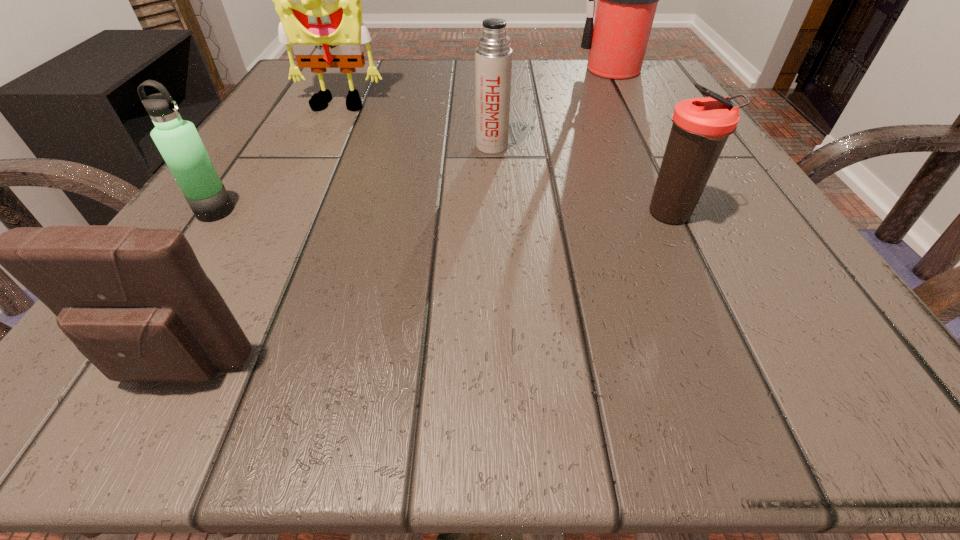
At what (x,y) coordinates should I click in order to perform the action: click on free space between the pouch and the fourth nearest object. Please return your answer as a coordinate pair (x, y). Looking at the image, I should click on (335, 258).

Locate which object ranks fifth in proximity to the pouch. Please provide its 2D coordinates. Your answer should be formatted as a tuple, i.e. [(x, y)], where the tuple contains the x and y coordinates of a point satisfying the conditions above.

[(627, 0)]

You are a GUI agent. You are given a task and a screenshot of the screen. Output one action in this format:
    pyautogui.click(x=<x>, y=<y>)
    Task: Click on the object that is the second nearest to the second farthest object
    The height and width of the screenshot is (540, 960).
    Given the screenshot: What is the action you would take?
    pyautogui.click(x=178, y=141)

Find the location of a particular element. Image resolution: width=960 pixels, height=540 pixels. thermos bottle that can be found as the second closest to the rightmost thermos bottle is located at coordinates (178, 141).

Locate an element on the screen. the closest thermos bottle to the second tallest object is located at coordinates (493, 57).

Identify the location of free spot that satisfies the following two spatial constraints: 1. on the face of the farthest thermos bottle; 2. on the right side of the second tallest object. (318, 146).

Where is `free space that satisfies the following two spatial constraints: 1. on the hose direction of the farthest object; 2. with an open flap on the pouch`? The image size is (960, 540). free space that satisfies the following two spatial constraints: 1. on the hose direction of the farthest object; 2. with an open flap on the pouch is located at coordinates (779, 370).

The width and height of the screenshot is (960, 540). In order to click on vacant point that satisfies the following two spatial constraints: 1. on the face of the sponge; 2. on the left side of the farthest thermos bottle in this screenshot , I will do `click(318, 146)`.

The image size is (960, 540). What are the coordinates of `blank space that satisfies the following two spatial constraints: 1. on the hose direction of the tallest object; 2. on the face of the fifth shortest object` in the screenshot? It's located at pos(636,107).

You are a GUI agent. You are given a task and a screenshot of the screen. Output one action in this format:
    pyautogui.click(x=<x>, y=<y>)
    Task: Click on the vacant region that satisfies the following two spatial constraints: 1. on the face of the rightmost thermos bottle; 2. on the right side of the second farthest object
    The image size is (960, 540).
    Given the screenshot: What is the action you would take?
    pyautogui.click(x=283, y=215)